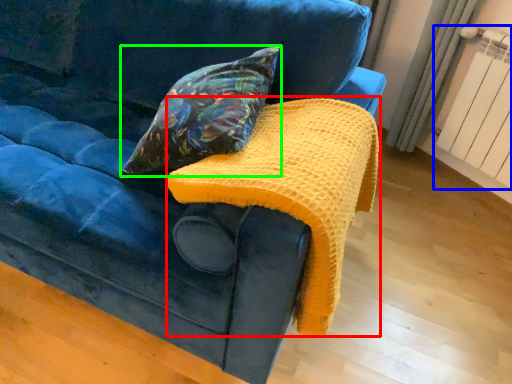
Question: Which object is the farthest from blanket (highlighted by a red box)? Choose among these: radiator (highlighted by a blue box) or pillow (highlighted by a green box).

Choices:
 (A) radiator
 (B) pillow

Answer: (A)